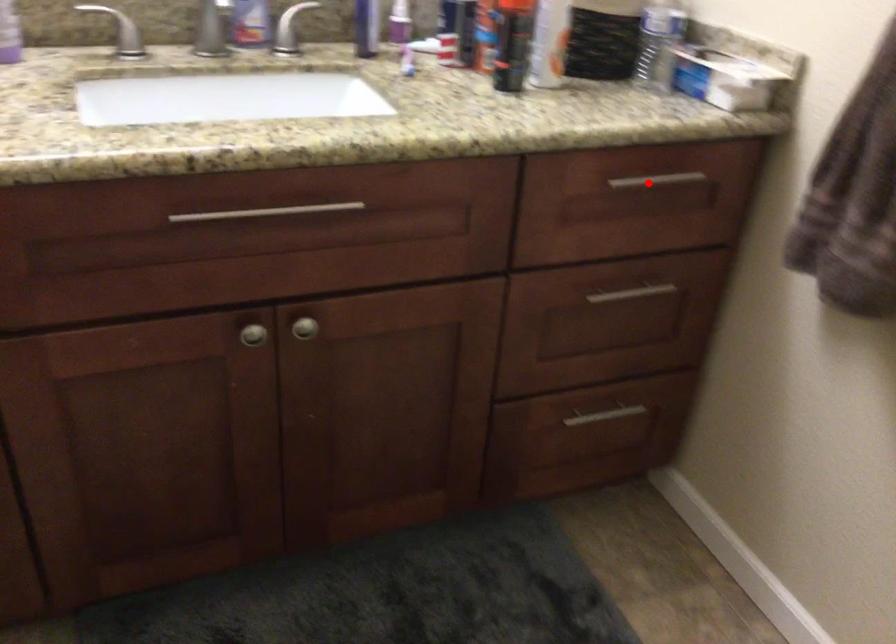
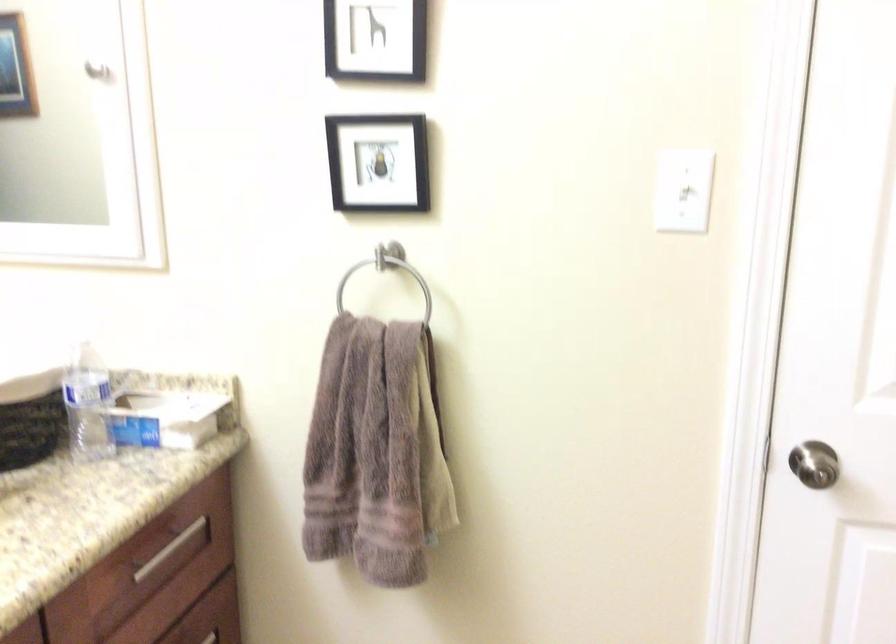
Locate, in the second image, the point that corresponds to the highlighted location in the first image.

(168, 549)